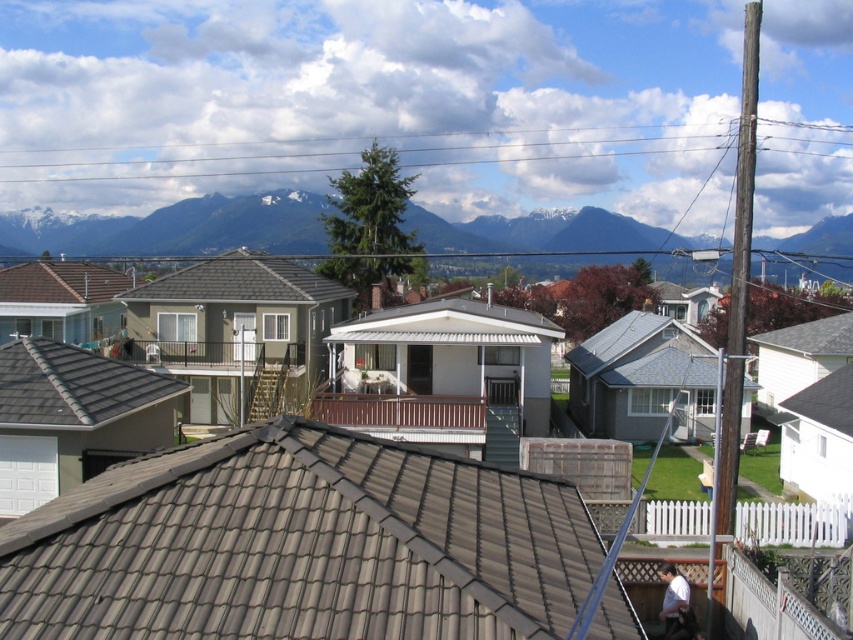
Does gray tile roof at lower left have a smaller size compared to brown tile roof at upper left?

Indeed, gray tile roof at lower left has a smaller size compared to brown tile roof at upper left.

Measure the distance between gray tile roof at lower left and camera.

18.84 meters

The width and height of the screenshot is (853, 640). Identify the location of gray tile roof at lower left. (73, 387).

Who is more distant from viewer, (41, 364) or (233, 289)?

The point (233, 289) is more distant.

At what (x,y) coordinates should I click in order to perform the action: click on gray tile roof at lower left. Please return your answer as a coordinate pair (x, y). Image resolution: width=853 pixels, height=640 pixels. Looking at the image, I should click on click(73, 387).

Where is `gray tile roof at lower left`? Image resolution: width=853 pixels, height=640 pixels. gray tile roof at lower left is located at coordinates (73, 387).

Does point (495, 554) lie in front of point (418, 337)?

Yes, point (495, 554) is in front of point (418, 337).

Which is more to the right, brown tile roof at upper center or white tile roof at center?

From the viewer's perspective, white tile roof at center appears more on the right side.

Find the location of a particular element. Image resolution: width=853 pixels, height=640 pixels. brown tile roof at upper center is located at coordinates (300, 545).

Locate an element on the screen. The image size is (853, 640). brown tile roof at upper center is located at coordinates (300, 545).